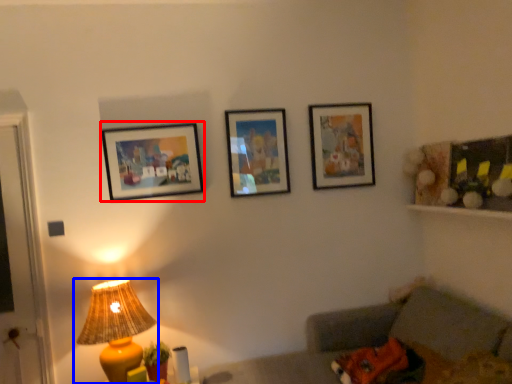
Question: Which object is further to the camera taking this photo, picture frame (highlighted by a red box) or lamp (highlighted by a blue box)?

Choices:
 (A) picture frame
 (B) lamp

Answer: (A)